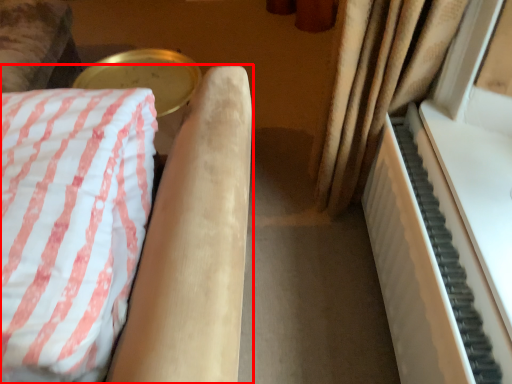
Question: Observing the image, what is the correct spatial positioning of furniture (annotated by the red box) in reference to piano?

Choices:
 (A) right
 (B) left

Answer: (B)